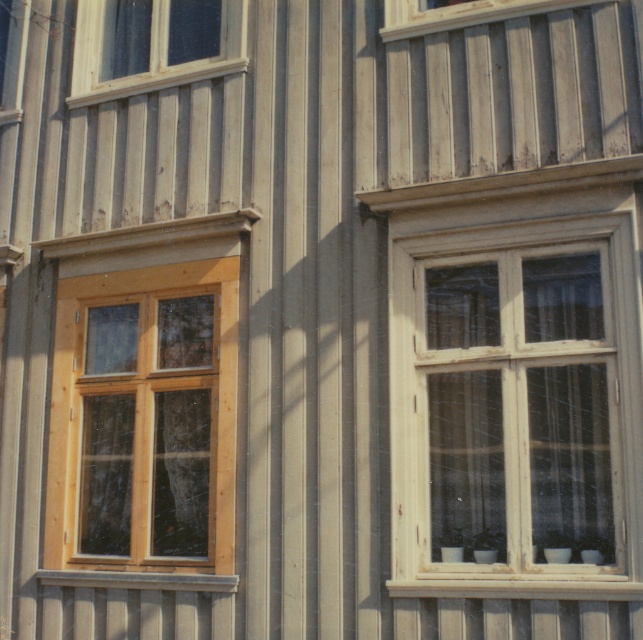
Question: Is matte wood window at upper left thinner than wooden window at upper left?

Choices:
 (A) no
 (B) yes

Answer: (A)

Question: Is matte wood window at upper left closer to camera compared to wooden window at upper left?

Choices:
 (A) no
 (B) yes

Answer: (B)

Question: Which of the following is the farthest from the observer?

Choices:
 (A) (104, 49)
 (B) (78, 310)
 (C) (520, 488)
 (D) (397, 29)

Answer: (A)

Question: Which point is farther to the camera?

Choices:
 (A) wooden window at upper left
 (B) wooden window at upper center

Answer: (A)

Question: Which point is farther to the camera?

Choices:
 (A) wooden window at center
 (B) wooden window at upper center
 (C) matte wood window at upper left
 (D) wooden window at upper left

Answer: (D)

Question: Does matte wood window at upper left appear on the left side of wooden window at upper center?

Choices:
 (A) no
 (B) yes

Answer: (B)